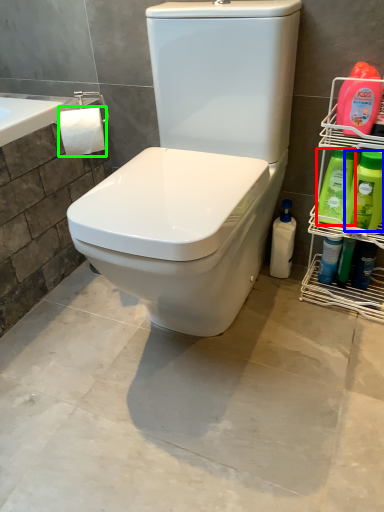
Question: Which is farther away from cleaning product (highlighted by a red box)? cleaning product (highlighted by a blue box) or toilet paper (highlighted by a green box)?

Choices:
 (A) cleaning product
 (B) toilet paper

Answer: (B)